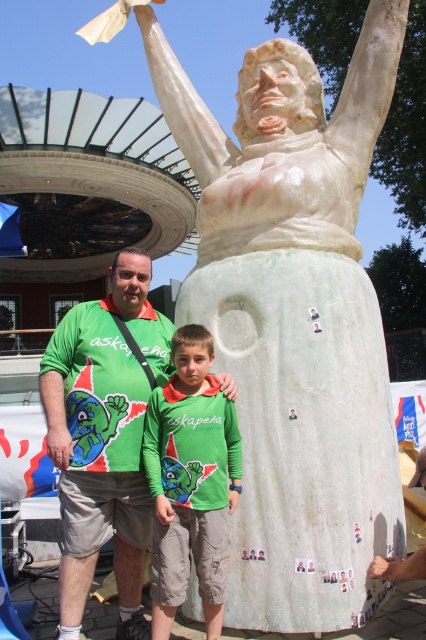
You are trying to decide which green shirt to wear for a cold day. Both the green fabric shirt at center and the green matte shirt at center are options. Based on their thickness, which one would be warmer?

The green matte shirt at center is thicker than the green fabric shirt at center, so it would be warmer.

You are a photographer standing 40 inches away from the two people in the image. You want to take a photo of both the green fabric shirt at center and the green matte shirt at center in the same frame. Can you do this without moving your position?

The green fabric shirt at center is 39.37 inches away from the green matte shirt at center. Since you are standing 40 inches away from both individuals, the distance between them is less than your distance from them, so they can both fit in the same frame without moving.